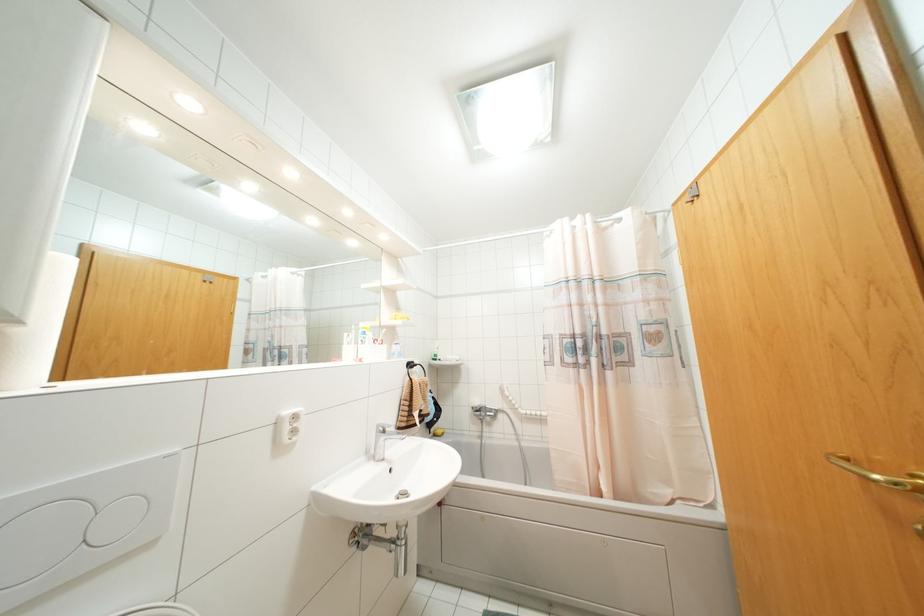
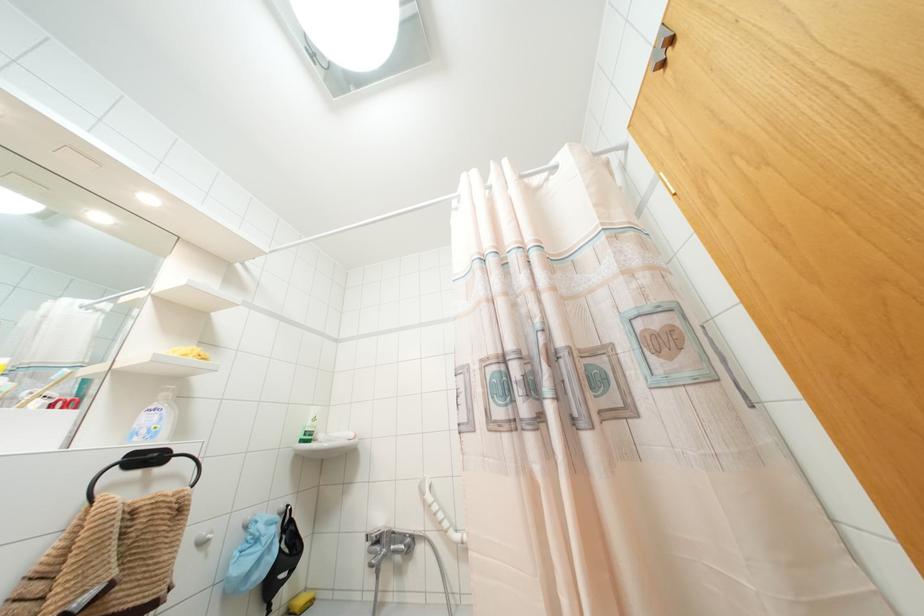
Question: Based on the continuous images, in which direction is the camera rotating? Reply with the corresponding letter.

Choices:
 (A) Left
 (B) Right
 (C) Up
 (D) Down

Answer: (C)